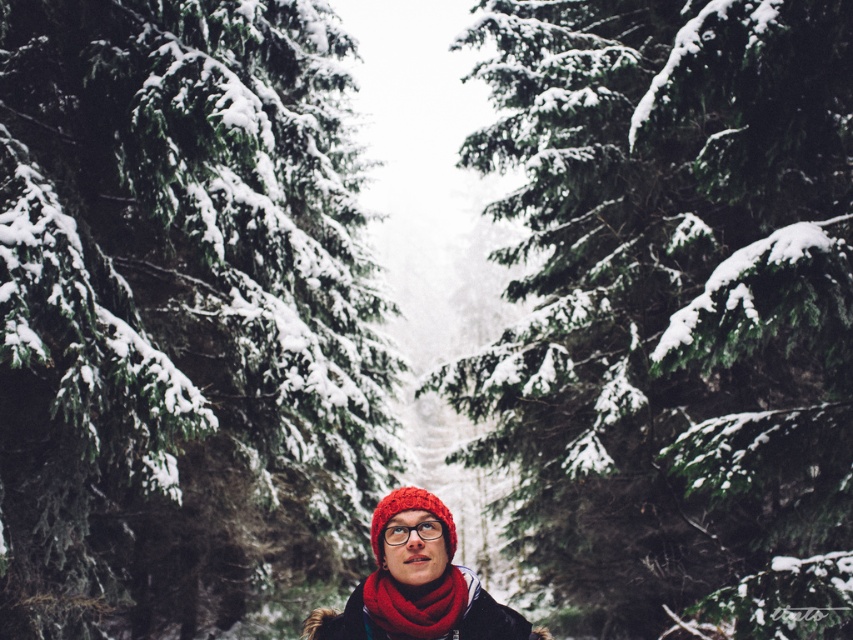
You are a photographer trying to capture the person in the winter forest scene. You notice the knitted wool scarf at center and the transparent plastic goggles at center. Which object is positioned lower on the person?

The knitted wool scarf at center is positioned lower than the transparent plastic goggles at center.